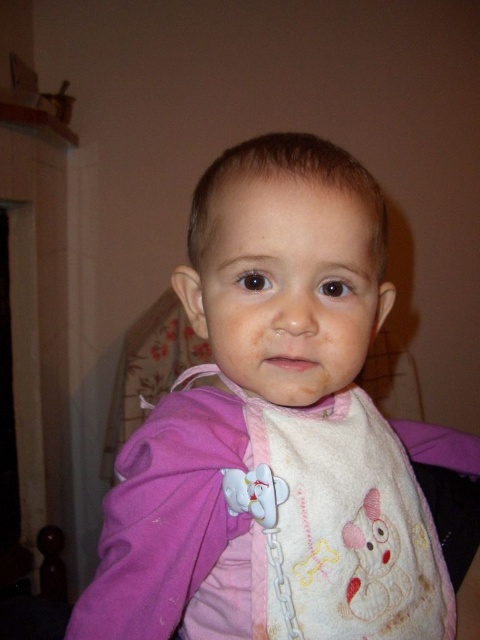
Question: Does pink fabric bib at center have a lesser width compared to white fabric bib at center?

Choices:
 (A) yes
 (B) no

Answer: (B)

Question: Which point is closer to the camera taking this photo?

Choices:
 (A) (283, 481)
 (B) (171, 488)

Answer: (A)

Question: Can you confirm if pink fabric bib at center is positioned above white fabric bib at center?

Choices:
 (A) yes
 (B) no

Answer: (A)

Question: Can you confirm if pink fabric bib at center is smaller than white fabric bib at center?

Choices:
 (A) no
 (B) yes

Answer: (A)